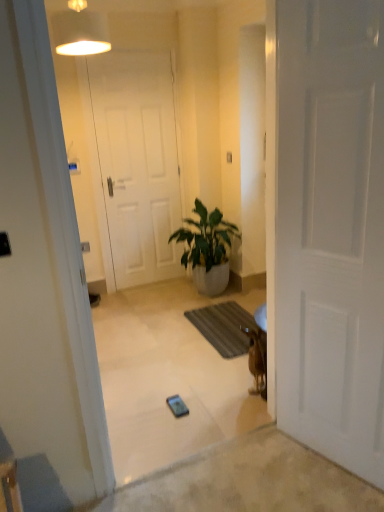
Question: From a real-world perspective, relative to metallic silver phone at center, is green glossy plant at center vertically above or below?

Choices:
 (A) below
 (B) above

Answer: (B)

Question: Is point (223, 233) closer or farther from the camera than point (185, 413)?

Choices:
 (A) closer
 (B) farther

Answer: (B)

Question: Which object is the closest to the green glossy plant at center?

Choices:
 (A) brown furry dog at right
 (B) brown textured mat at lower center
 (C) white matte door at center, the 1th door positioned from the right
 (D) white fabric lampshade at upper center
 (E) white matte door at center, which ranks as the first door in left-to-right order

Answer: (B)

Question: Which is farther from the brown furry dog at right?

Choices:
 (A) white fabric lampshade at upper center
 (B) white matte door at center, which ranks as the first door in left-to-right order
 (C) metallic silver phone at center
 (D) white matte door at center, which is the 2th door in left-to-right order
 (E) brown textured mat at lower center

Answer: (B)